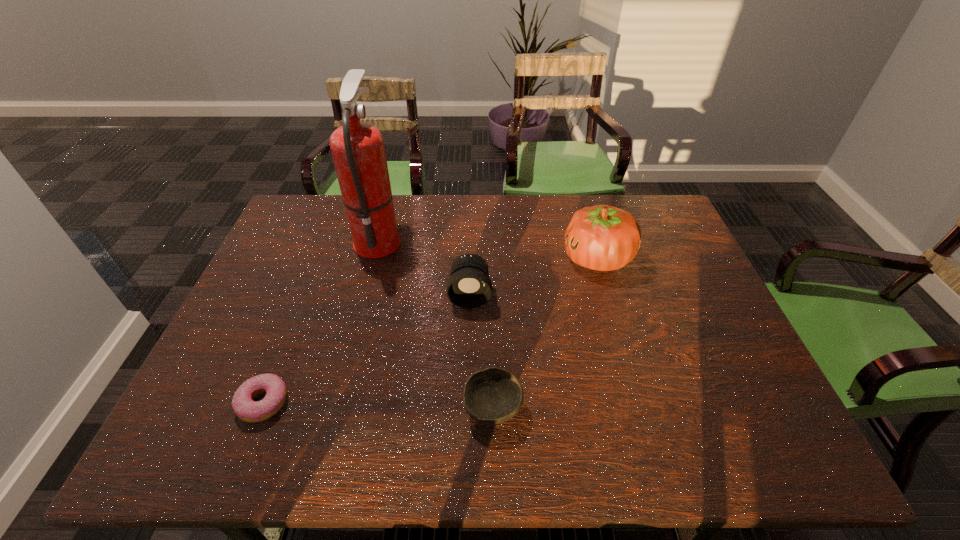
The image size is (960, 540). What are the coordinates of `fire extinguisher` in the screenshot? It's located at (358, 151).

At what (x,y) coordinates should I click in order to perform the action: click on the tallest object. Please return your answer as a coordinate pair (x, y). Looking at the image, I should click on (358, 151).

The image size is (960, 540). I want to click on pumpkin, so click(x=604, y=238).

This screenshot has height=540, width=960. I want to click on the fourth shortest object, so pos(604,238).

Locate an element on the screen. telephoto lens is located at coordinates (468, 286).

Identify the location of the second shortest object. The width and height of the screenshot is (960, 540). (491, 396).

This screenshot has width=960, height=540. I want to click on the shortest object, so click(244, 407).

Where is `doughnut`? The height and width of the screenshot is (540, 960). doughnut is located at coordinates (244, 407).

The image size is (960, 540). Find the location of `vacant space located with the handle and hose on the tallest object`. vacant space located with the handle and hose on the tallest object is located at coordinates (429, 239).

Find the location of `free region located 0.180m on the side of the rightmost object with the cute face`. free region located 0.180m on the side of the rightmost object with the cute face is located at coordinates (504, 258).